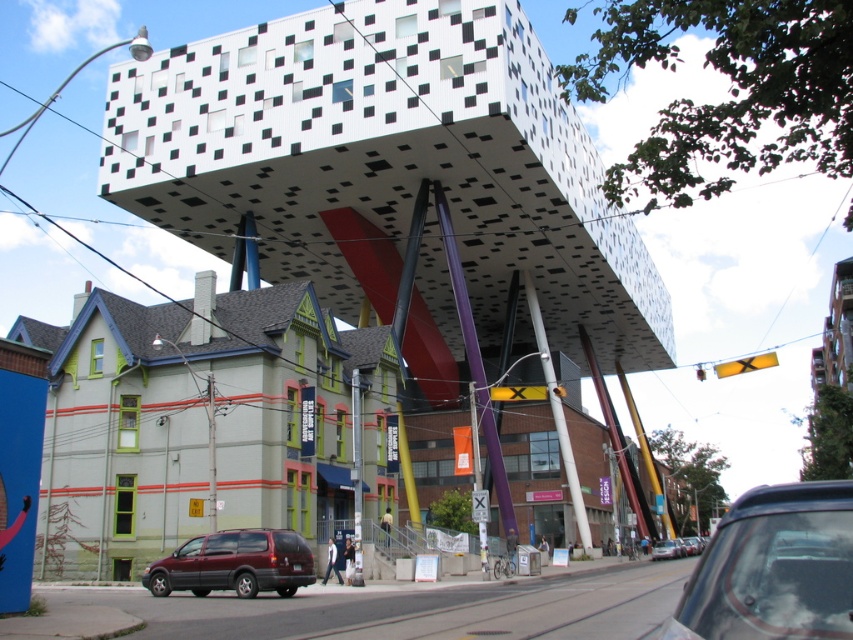
You are a delivery person needing to park your vehicle in the parking spot closest to the traditional building. Which vehicle, the matte black car at lower right or the maroon matte suv at lower left, is closer to the traditional building?

The maroon matte suv at lower left is closer to the traditional building because it is positioned at the lower left near the traditional building, whereas the matte black car at lower right is farther away on the opposite side.

Looking at this image, you are a delivery driver who needs to park your vehicle in a space that can accommodate your car. The parking spot you are considering is 2.5 meters wide. Based on the image, can the maroon matte suv at lower left and the metallic silver car at center both fit into this space individually?

The maroon matte suv at lower left might be wider than metallic silver car at center. Since the parking space is 2.5 meters wide, the metallic silver car at center can fit, but the maroon matte suv at lower left might be too wide to fit.

You are a driver trying to park your car in this urban area. You see the maroon matte suv at lower left and the metallic silver car at center. Which vehicle is blocking the parking spot more towards the front?

The maroon matte suv at lower left is positioned over the metallic silver car at center, meaning it is blocking the parking spot more towards the front.